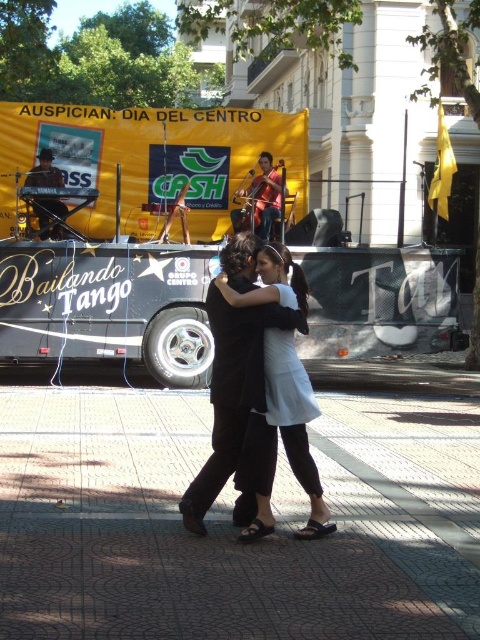
Is orange fabric cello at center smaller than shiny black drum set at upper left?

No, orange fabric cello at center is not smaller than shiny black drum set at upper left.

Does orange fabric cello at center have a lesser height compared to shiny black drum set at upper left?

No.

Which is in front, point (241, 189) or point (55, 211)?

Point (55, 211) is more forward.

At what (x,y) coordinates should I click in order to perform the action: click on orange fabric cello at center. Please return your answer as a coordinate pair (x, y). Image resolution: width=480 pixels, height=640 pixels. Looking at the image, I should click on (264, 195).

Is point (248, 497) more distant than point (255, 214)?

No, (248, 497) is closer to viewer.

Can you confirm if black matte dress at center is positioned to the left of orange fabric cello at center?

Correct, you'll find black matte dress at center to the left of orange fabric cello at center.

Describe the element at coordinates (240, 404) in the screenshot. I see `black matte dress at center` at that location.

Image resolution: width=480 pixels, height=640 pixels. I want to click on black matte dress at center, so click(240, 404).

Who is more forward, (240, 397) or (46, 220)?

Point (240, 397) is more forward.

Between black matte dress at center and shiny black drum set at upper left, which one is positioned higher?

Positioned higher is shiny black drum set at upper left.

Is point (295, 323) closer to viewer compared to point (49, 157)?

Yes, it is.

Identify the location of black matte dress at center. The width and height of the screenshot is (480, 640). (240, 404).